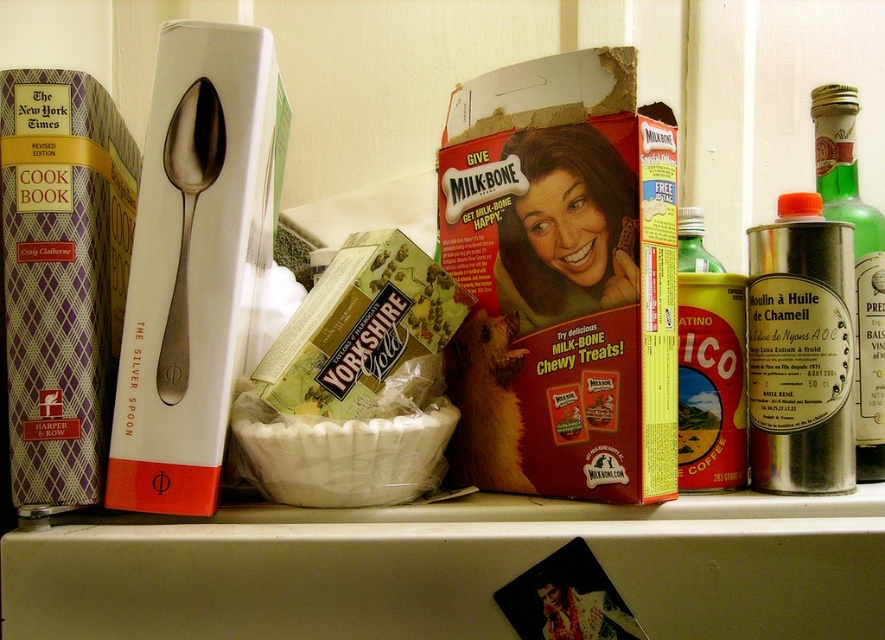
Which is more to the right, silver metallic canister at right or metallic silver canister at center right?

From the viewer's perspective, silver metallic canister at right appears more on the right side.

You are a GUI agent. You are given a task and a screenshot of the screen. Output one action in this format:
    pyautogui.click(x=<x>, y=<y>)
    Task: Click on the silver metallic canister at right
    
    Given the screenshot: What is the action you would take?
    pyautogui.click(x=799, y=349)

Can you confirm if silver metallic canister at right is taller than metallic silver canister at right?

Incorrect, silver metallic canister at right's height is not larger of metallic silver canister at right's.

Which is more to the right, silver metallic canister at right or metallic silver canister at right?

metallic silver canister at right

Find the location of `silver metallic canister at right`. silver metallic canister at right is located at coordinates (799, 349).

Find the location of a particular element. Image resolution: width=885 pixels, height=640 pixels. silver metallic canister at right is located at coordinates tap(799, 349).

Between metallic silver canister at right and metallic silver canister at center right, which one has more height?

metallic silver canister at right

Is metallic silver canister at right above metallic silver canister at center right?

Actually, metallic silver canister at right is below metallic silver canister at center right.

At what (x,y) coordinates should I click in order to perform the action: click on metallic silver canister at right. Please return your answer as a coordinate pair (x, y). Looking at the image, I should click on (855, 262).

At what (x,y) coordinates should I click in order to perform the action: click on metallic silver canister at right. Please return your answer as a coordinate pair (x, y). The width and height of the screenshot is (885, 640). Looking at the image, I should click on (855, 262).